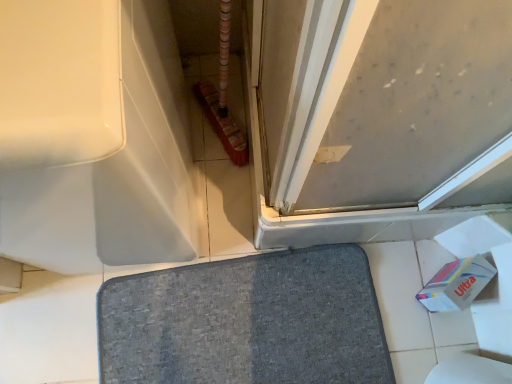
Question: Is gray fabric bath mat at center bigger or smaller than white cardboard toilet paper at lower right?

Choices:
 (A) small
 (B) big

Answer: (B)

Question: Considering the positions of gray fabric bath mat at center and white cardboard toilet paper at lower right in the image, is gray fabric bath mat at center taller or shorter than white cardboard toilet paper at lower right?

Choices:
 (A) tall
 (B) short

Answer: (B)

Question: Estimate the real-world distances between objects in this image. Which object is closer to the white cardboard toilet paper at lower right?

Choices:
 (A) gray fabric bath mat at center
 (B) white glossy bathtub at upper left
 (C) matte gray screen door at upper right

Answer: (A)

Question: Which of these objects is positioned closest to the gray fabric bath mat at center?

Choices:
 (A) white glossy bathtub at upper left
 (B) matte gray screen door at upper right
 (C) white cardboard toilet paper at lower right

Answer: (C)